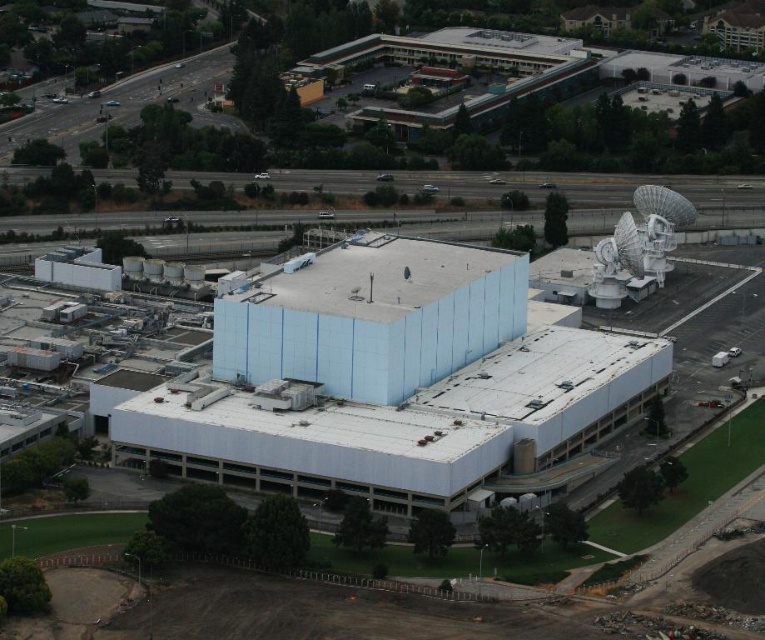
You are standing at a viewpoint overlooking the industrial complex. There is a specific point marked at coordinates point (469, 305). If you want to place a new observation tower that must be at least 500 meters away from this point, can you confirm if the current location you are standing at is suitable?

The distance of point (469, 305) from viewer is 546.83 meters, so yes, the current location is suitable because it is more than 500 meters away from the point.

You are a drone operator trying to locate the white matte building at center. According to the map coordinates, where should you direct your drone to find it?

The white matte building at center is located at point (391, 380).

You are a drone operator planning to fly a drone over the industrial complex. The drone has a maximum flight height of 100 meters. Given the height difference between the white matte building at center and the white metallic satellite at upper right, will the drone be able to fly safely above both structures without any obstruction?

The white matte building at center is much taller than the white metallic satellite at upper right. Since the drone has a maximum flight height of 100 meters, it can fly safely above both structures as long as its altitude exceeds the height of the taller white matte building at center. However, the exact feasibility depends on the actual height of the building, which isn answer provided. Please ensure the drone reaches a height above the building to avoid obstruction.